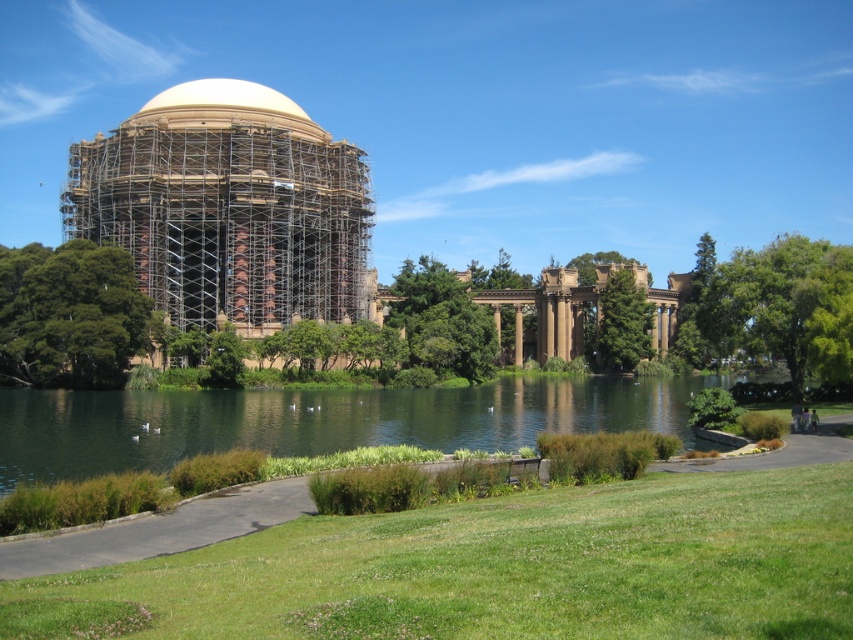
Question: Does green leafy tree at left have a larger size compared to white textured dome at upper center?

Choices:
 (A) no
 (B) yes

Answer: (A)

Question: Among these objects, which one is nearest to the camera?

Choices:
 (A) white textured dome at upper center
 (B) green leafy tree at center-right

Answer: (A)

Question: Does green leafy tree at right appear under white textured dome at upper center?

Choices:
 (A) no
 (B) yes

Answer: (B)

Question: Among these points, which one is farthest from the camera?

Choices:
 (A) (849, 250)
 (B) (195, 205)
 (C) (605, 332)
 (D) (102, 316)

Answer: (C)

Question: Which is nearer to the white textured dome at upper center?

Choices:
 (A) beige stone dome at center
 (B) green leafy tree at left

Answer: (A)

Question: Is brown stone columns at center positioned behind white textured dome at upper center?

Choices:
 (A) no
 (B) yes

Answer: (B)